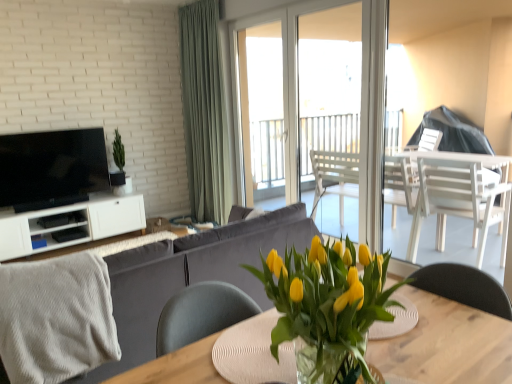
Question: Is wooden table at center in contact with transparent glass door at center?

Choices:
 (A) yes
 (B) no

Answer: (B)

Question: From a real-world perspective, is wooden table at center beneath transparent glass door at center?

Choices:
 (A) no
 (B) yes

Answer: (B)

Question: Does wooden table at center have a lesser width compared to transparent glass door at center?

Choices:
 (A) yes
 (B) no

Answer: (B)

Question: Considering the relative sizes of wooden table at center and transparent glass door at center in the image provided, is wooden table at center smaller than transparent glass door at center?

Choices:
 (A) no
 (B) yes

Answer: (A)

Question: Is wooden table at center far away from transparent glass door at center?

Choices:
 (A) no
 (B) yes

Answer: (B)

Question: From the image's perspective, is matte black tv at left positioned above or below green fabric curtain at center?

Choices:
 (A) below
 (B) above

Answer: (A)

Question: Do you think matte black tv at left is within green fabric curtain at center, or outside of it?

Choices:
 (A) inside
 (B) outside

Answer: (B)

Question: Looking at their shapes, would you say matte black tv at left is wider or thinner than green fabric curtain at center?

Choices:
 (A) wide
 (B) thin

Answer: (B)

Question: Relative to green fabric curtain at center, is matte black tv at left in front or behind?

Choices:
 (A) front
 (B) behind

Answer: (A)

Question: From the image's perspective, is wooden table at center positioned above or below yellow matte tulips at center?

Choices:
 (A) below
 (B) above

Answer: (A)

Question: Is point (416, 291) positioned closer to the camera than point (364, 297)?

Choices:
 (A) closer
 (B) farther

Answer: (B)

Question: In terms of size, does wooden table at center appear bigger or smaller than yellow matte tulips at center?

Choices:
 (A) small
 (B) big

Answer: (B)

Question: Is wooden table at center taller or shorter than yellow matte tulips at center?

Choices:
 (A) tall
 (B) short

Answer: (A)

Question: Is transparent glass door at center spatially inside translucent glass vase at center, or outside of it?

Choices:
 (A) outside
 (B) inside

Answer: (A)

Question: From the image's perspective, is transparent glass door at center positioned above or below translucent glass vase at center?

Choices:
 (A) above
 (B) below

Answer: (A)